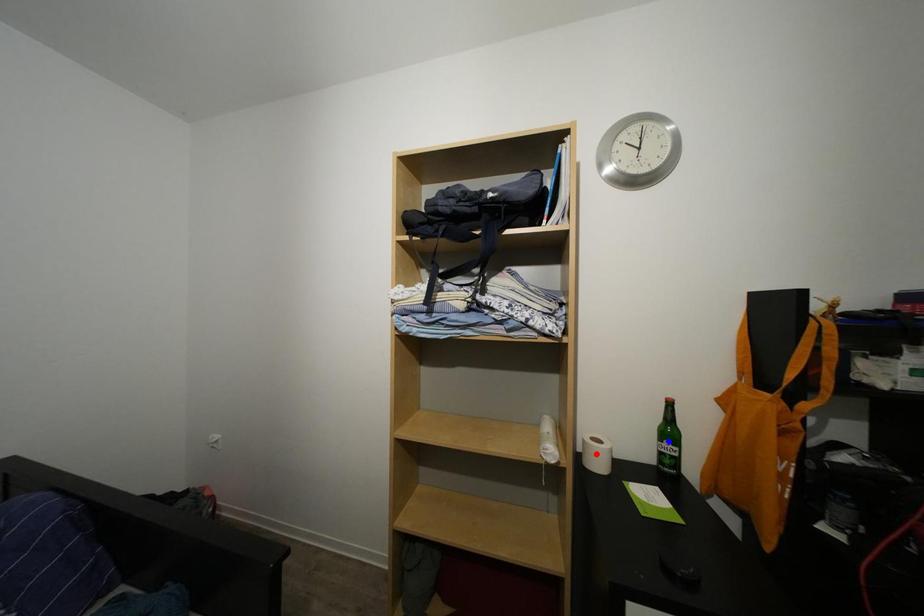
Question: In the image, two points are highlighted. Which point is nearer to the camera? Reply with the corresponding letter.

Choices:
 (A) blue point
 (B) red point

Answer: (A)